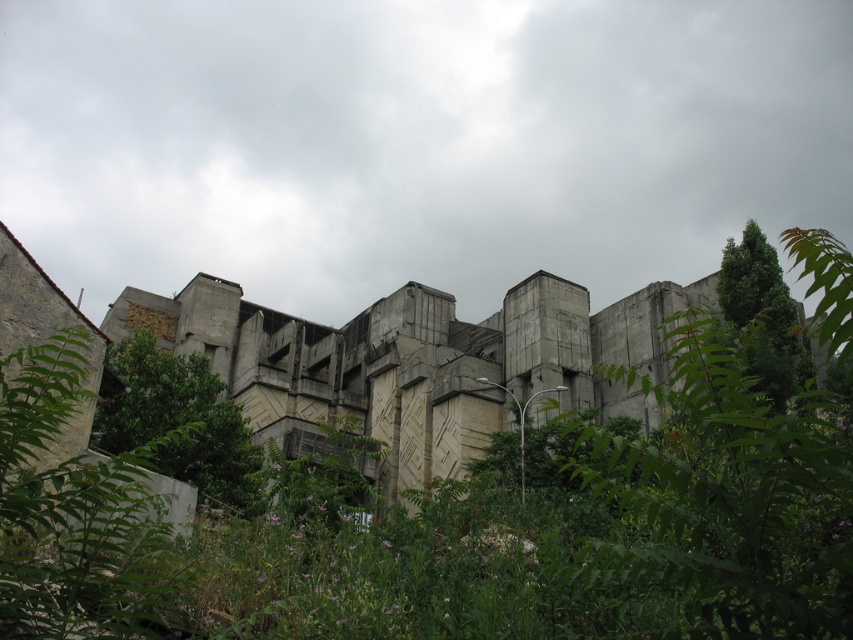
Does green leafy tree at lower left appear over green leafy tree at center?

No, green leafy tree at lower left is not above green leafy tree at center.

Does green leafy tree at lower left come in front of green leafy tree at center?

Yes, green leafy tree at lower left is in front of green leafy tree at center.

At what (x,y) coordinates should I click in order to perform the action: click on green leafy tree at lower left. Please return your answer as a coordinate pair (x, y). Looking at the image, I should click on (74, 513).

Does green leafy tree at lower left lie behind green leafy tree at upper right?

No, it is not.

Is point (28, 600) positioned in front of point (751, 221)?

Yes.

Is point (56, 612) behind point (770, 275)?

No, (56, 612) is closer to viewer.

Image resolution: width=853 pixels, height=640 pixels. In order to click on green leafy tree at lower left in this screenshot , I will do `click(74, 513)`.

Describe the element at coordinates (180, 422) in the screenshot. I see `green leafy tree at center` at that location.

Can you confirm if green leafy tree at center is shorter than green leafy tree at upper right?

Indeed, green leafy tree at center has a lesser height compared to green leafy tree at upper right.

Locate an element on the screen. The height and width of the screenshot is (640, 853). green leafy tree at center is located at coordinates (180, 422).

Where is `green leafy tree at center`? green leafy tree at center is located at coordinates (180, 422).